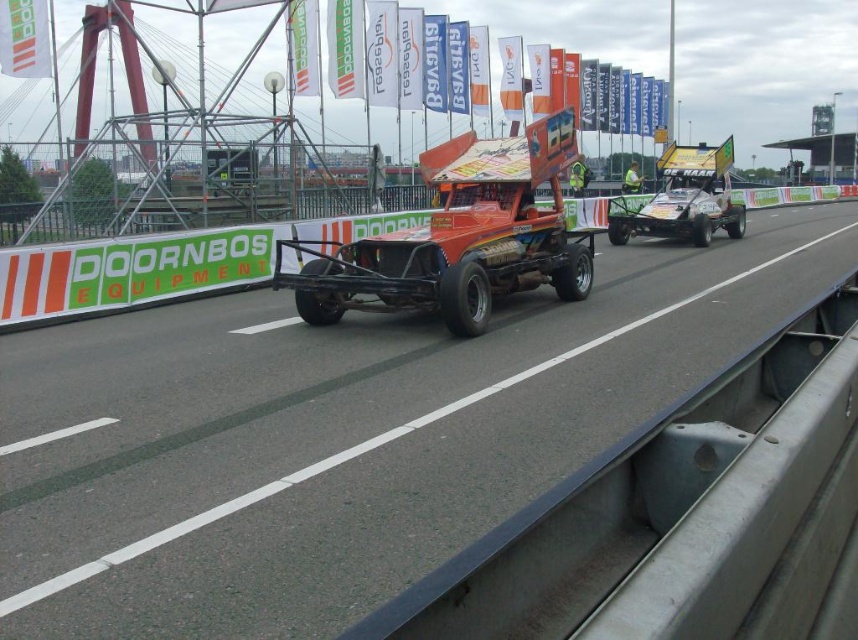
From the picture: Measure the distance from orange matte race car at center to yellow metallic race car at center.

The distance of orange matte race car at center from yellow metallic race car at center is 10.46 meters.

Who is shorter, orange matte race car at center or yellow metallic race car at center?

Standing shorter between the two is orange matte race car at center.

Does point (535, 252) lie behind point (718, 176)?

No, it is not.

Find the location of a particular element. orange matte race car at center is located at coordinates (460, 237).

Between smooth asphalt road at center and orange matte race car at center, which one has less height?

With less height is smooth asphalt road at center.

Does smooth asphalt road at center have a lesser height compared to orange matte race car at center?

Indeed, smooth asphalt road at center has a lesser height compared to orange matte race car at center.

Is point (529, 388) closer to camera compared to point (542, 140)?

Yes, point (529, 388) is in front of point (542, 140).

Where is `smooth asphalt road at center`? The height and width of the screenshot is (640, 858). smooth asphalt road at center is located at coordinates (342, 435).

Can you confirm if smooth asphalt road at center is bigger than yellow metallic race car at center?

Correct, smooth asphalt road at center is larger in size than yellow metallic race car at center.

Does point (446, 499) lie behind point (729, 180)?

No, (446, 499) is in front of (729, 180).

Locate an element on the screen. smooth asphalt road at center is located at coordinates (342, 435).